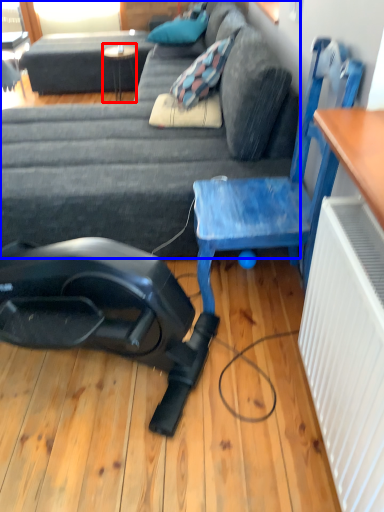
Question: Which point is further to the camera, table (highlighted by a red box) or studio couch (highlighted by a blue box)?

Choices:
 (A) table
 (B) studio couch

Answer: (A)